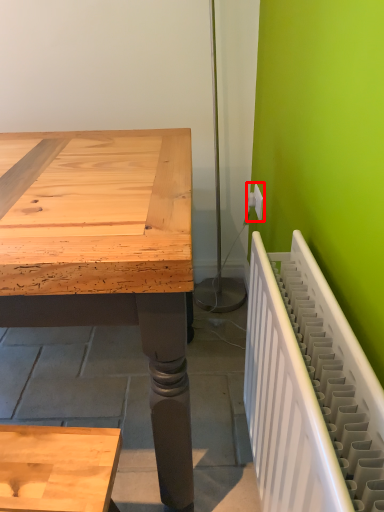
Question: From the image's perspective, what is the correct spatial positioning of electric outlet (annotated by the red box) in reference to radiator?

Choices:
 (A) above
 (B) below

Answer: (A)